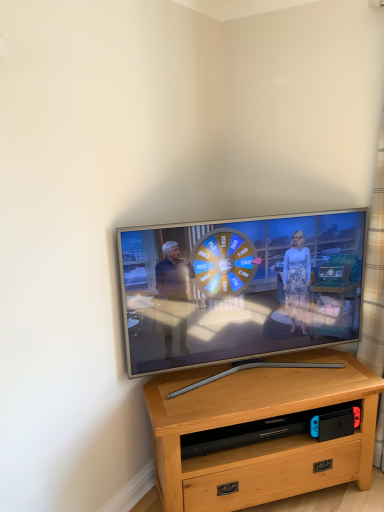
In order to click on vacant space underneath silver metallic tv at center (from a real-world perspective) in this screenshot , I will do `click(248, 368)`.